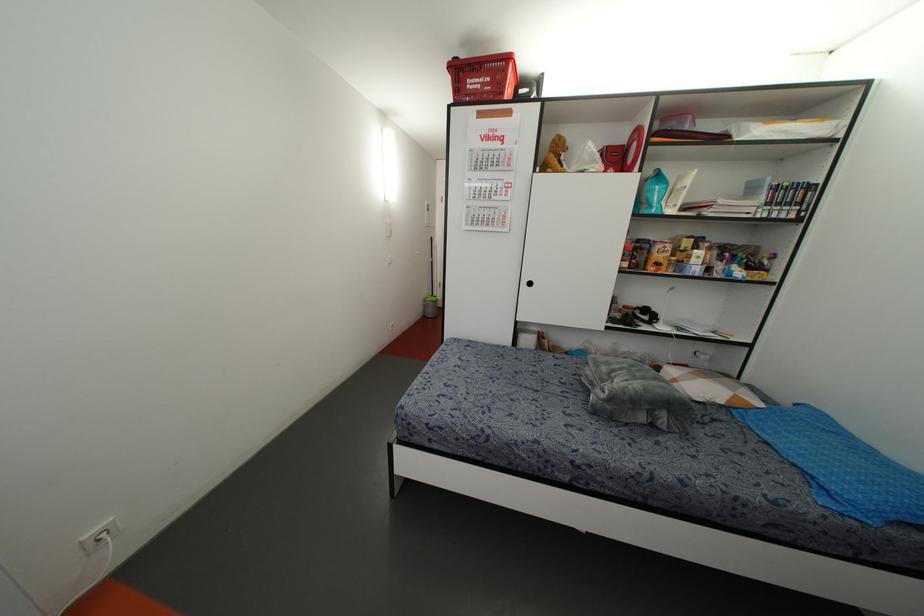
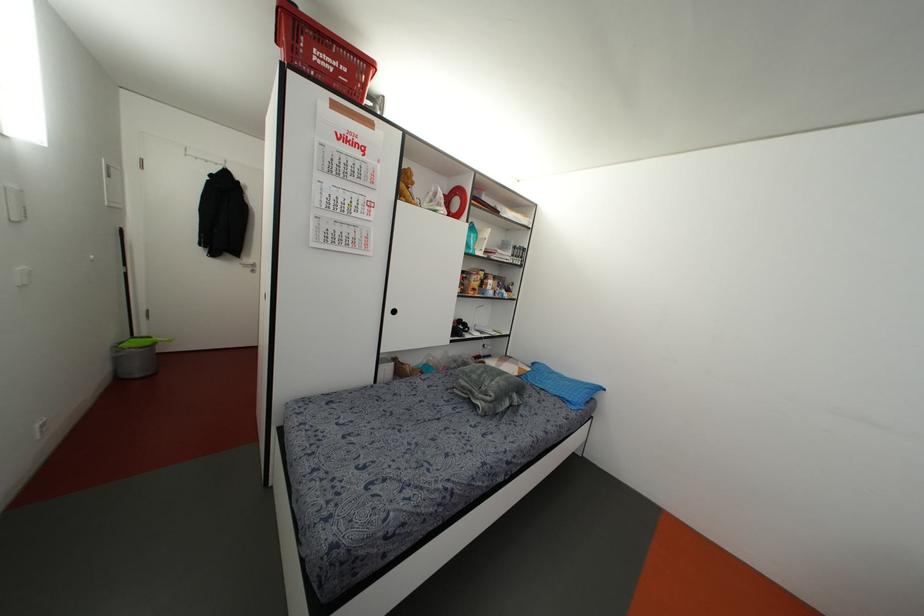
Question: The images are taken continuously from a first-person perspective. In which direction is your viewpoint rotating?

Choices:
 (A) Left
 (B) Right
 (C) Up
 (D) Down

Answer: (B)